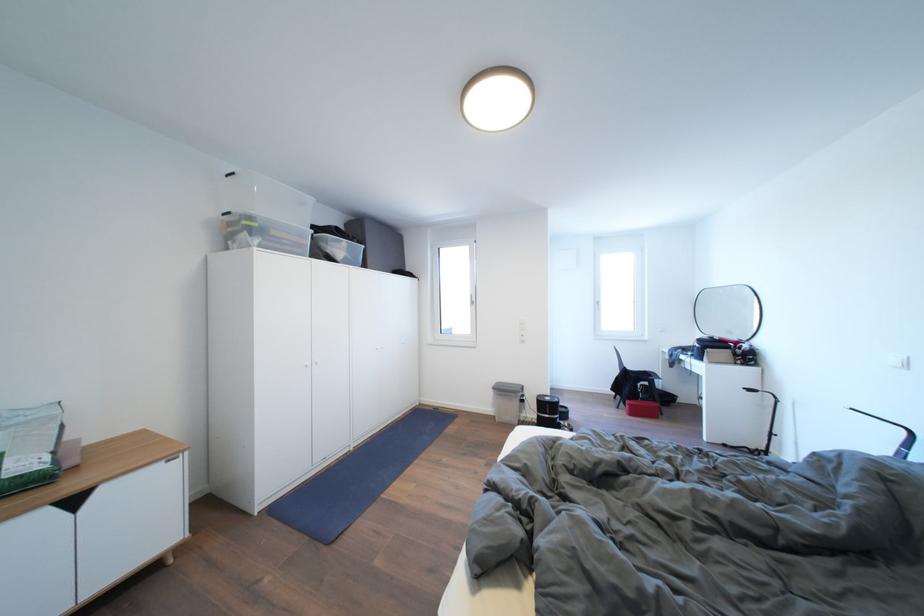
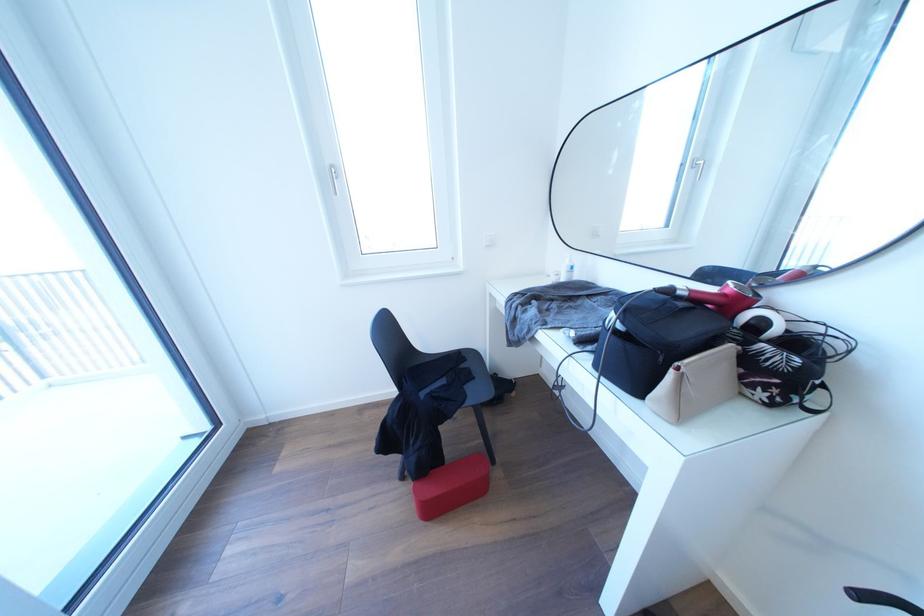
Locate, in the second image, the point that corresponds to (x=720, y=342) in the first image.

(675, 296)